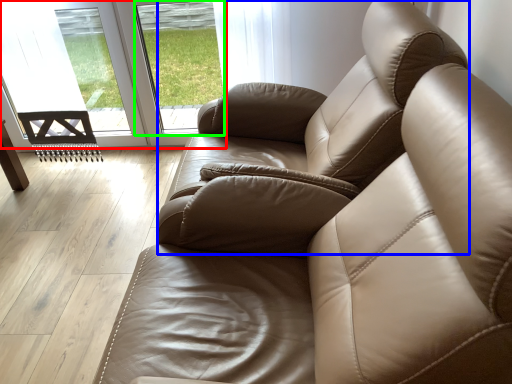
Question: Which object is the farthest from glass door (highlighted by a red box)? Choose among these: armchair (highlighted by a blue box) or window (highlighted by a green box).

Choices:
 (A) armchair
 (B) window

Answer: (A)